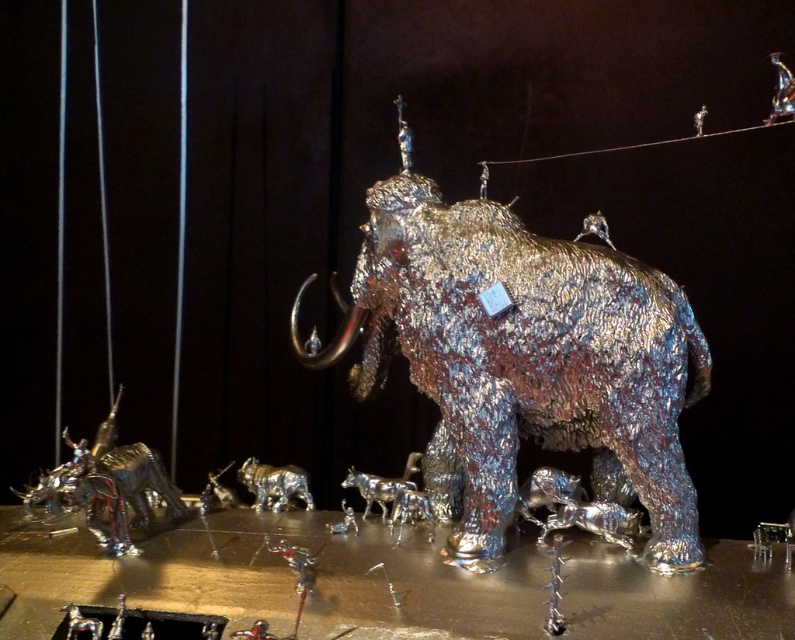
Can you confirm if shiny metallic elephant at center is smaller than shiny metallic dinosaur at lower left?

No, shiny metallic elephant at center is not smaller than shiny metallic dinosaur at lower left.

Does shiny metallic elephant at center appear on the left side of shiny metallic dinosaur at lower left?

Incorrect, shiny metallic elephant at center is not on the left side of shiny metallic dinosaur at lower left.

The width and height of the screenshot is (795, 640). What do you see at coordinates (520, 356) in the screenshot? I see `shiny metallic elephant at center` at bounding box center [520, 356].

Find the location of `shiny metallic elephant at center`. shiny metallic elephant at center is located at coordinates (520, 356).